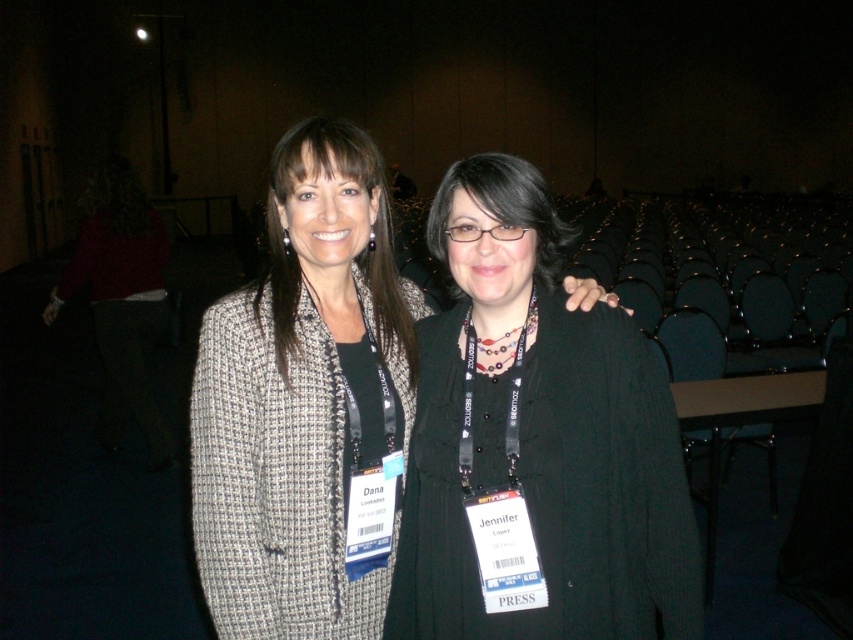
Question: Is black matte jacket at center smaller than matte gray blazer at center?

Choices:
 (A) no
 (B) yes

Answer: (B)

Question: Is black matte jacket at center above matte gray blazer at center?

Choices:
 (A) no
 (B) yes

Answer: (A)

Question: Which point is farther to the camera?

Choices:
 (A) matte gray blazer at center
 (B) black matte jacket at center

Answer: (A)

Question: Does black matte jacket at center have a lesser width compared to matte gray blazer at center?

Choices:
 (A) no
 (B) yes

Answer: (A)

Question: Which object appears closest to the camera in this image?

Choices:
 (A) black matte jacket at center
 (B) matte gray blazer at center

Answer: (A)

Question: Which point appears closest to the camera in this image?

Choices:
 (A) (485, 205)
 (B) (340, 150)

Answer: (A)